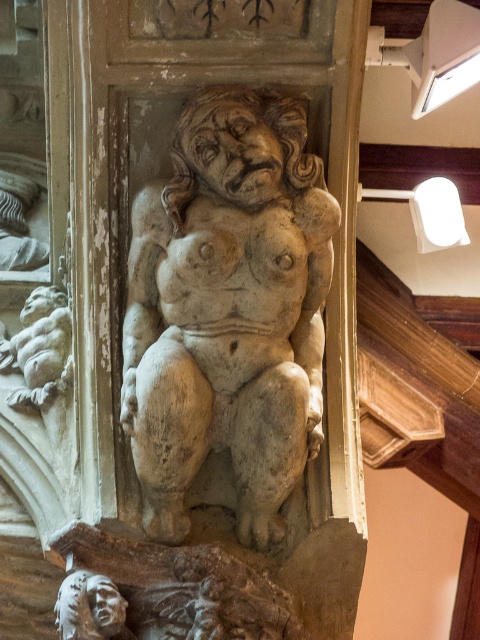
You are an art student observing the sculpture and notice two elements at the lower left corner. Which one is placed higher up between the smooth stone cherub at lower left and the white stone head at lower left?

The smooth stone cherub at lower left is positioned over the white stone head at lower left, so it is higher up.

You are an art conservator standing in front of the sculpture. You need to place a protective barrier around the stone statue at center. Where should you position the barrier to ensure it is centered around the statue?

The stone statue at center is located at the 2D coordinates point (228,310), so you should position the barrier around those coordinates to ensure it is centered.